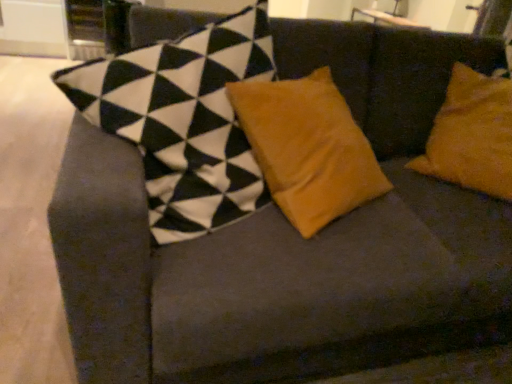
The image size is (512, 384). What do you see at coordinates (472, 135) in the screenshot?
I see `velvety yellow pillow at right` at bounding box center [472, 135].

At what (x,y) coordinates should I click in order to perform the action: click on velvety yellow pillow at right. Please return your answer as a coordinate pair (x, y). Looking at the image, I should click on (472, 135).

Where is `velvety yellow pillow at right`? velvety yellow pillow at right is located at coordinates (472, 135).